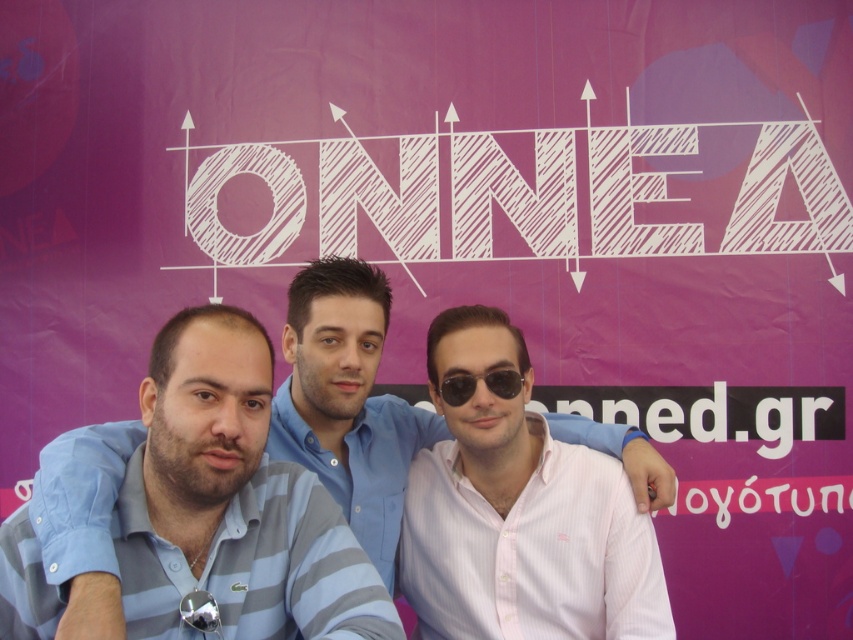
Question: Which is nearer to the pink striped shirt at center?

Choices:
 (A) blue striped polo shirt at center
 (B) black plastic sunglasses at center

Answer: (B)

Question: Which of these objects is positioned farthest from the black plastic sunglasses at center?

Choices:
 (A) blue striped polo shirt at center
 (B) pink striped shirt at center

Answer: (A)

Question: Does blue striped polo shirt at center have a lesser width compared to black plastic sunglasses at center?

Choices:
 (A) yes
 (B) no

Answer: (B)

Question: Is blue striped polo shirt at center positioned in front of black plastic sunglasses at center?

Choices:
 (A) yes
 (B) no

Answer: (A)

Question: Estimate the real-world distances between objects in this image. Which object is closer to the black plastic sunglasses at center?

Choices:
 (A) blue striped polo shirt at center
 (B) pink striped shirt at center

Answer: (B)

Question: Does pink striped shirt at center appear on the right side of black plastic sunglasses at center?

Choices:
 (A) yes
 (B) no

Answer: (A)